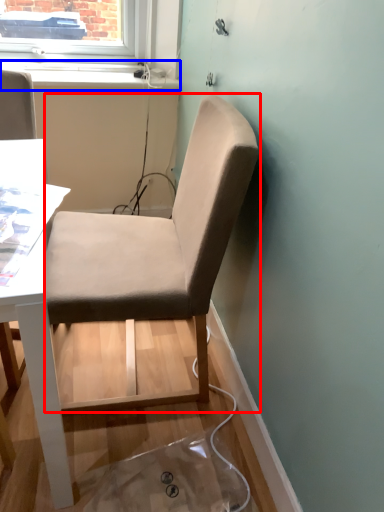
Question: Which of the following is the farthest to the observer, chair (highlighted by a red box) or window sill (highlighted by a blue box)?

Choices:
 (A) chair
 (B) window sill

Answer: (B)